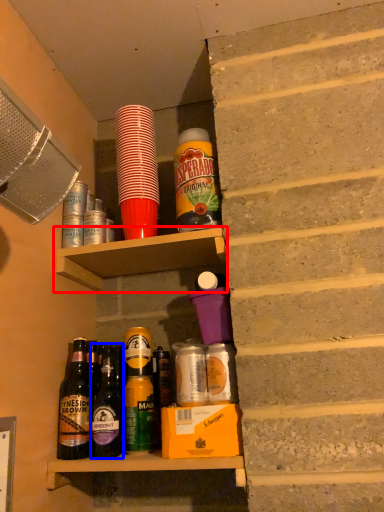
Question: Which object is closer to the camera taking this photo, shelf (highlighted by a red box) or bottle (highlighted by a blue box)?

Choices:
 (A) shelf
 (B) bottle

Answer: (B)